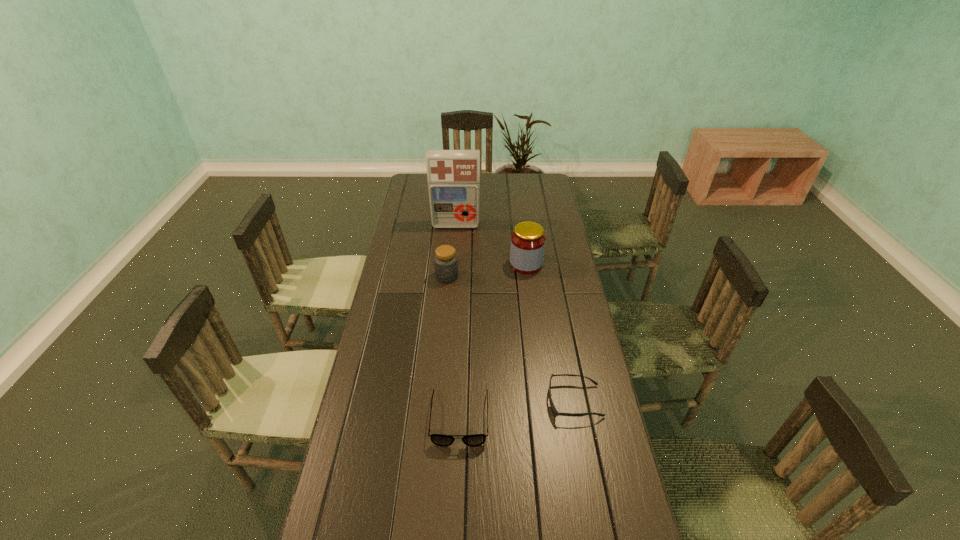
You are a GUI agent. You are given a task and a screenshot of the screen. Output one action in this format:
    pyautogui.click(x=<x>, y=<y>)
    Task: Click on the vacant area that lies between the first-aid kit and the spectacles
    The height and width of the screenshot is (540, 960).
    Given the screenshot: What is the action you would take?
    pyautogui.click(x=458, y=322)

Identify the location of unoccupied position between the sunglasses and the shorter jar. This screenshot has height=540, width=960. (511, 339).

The width and height of the screenshot is (960, 540). What are the coordinates of `vacant space that's between the spectacles and the tallest object` in the screenshot? It's located at (458, 322).

At what (x,y) coordinates should I click in order to perform the action: click on vacant area that lies between the spectacles and the farthest object. Please return your answer as a coordinate pair (x, y). This screenshot has height=540, width=960. Looking at the image, I should click on (458, 322).

I want to click on free space between the first-aid kit and the shortest object, so click(x=516, y=313).

This screenshot has height=540, width=960. What are the coordinates of `vacant area that lies between the third shortest object and the second shortest object` in the screenshot? It's located at (453, 347).

Find the location of `free space between the taller jar and the second shortest object`. free space between the taller jar and the second shortest object is located at coordinates (492, 341).

Where is `empty location between the right jar and the shorter jar`? empty location between the right jar and the shorter jar is located at coordinates (487, 270).

The width and height of the screenshot is (960, 540). What are the coordinates of `free space between the tallest object and the spectacles` in the screenshot? It's located at (458, 322).

Choose which object is the second nearest neighbor to the shortest object. Please provide its 2D coordinates. Your answer should be formatted as a tuple, i.e. [(x, y)], where the tuple contains the x and y coordinates of a point satisfying the conditions above.

[(527, 247)]